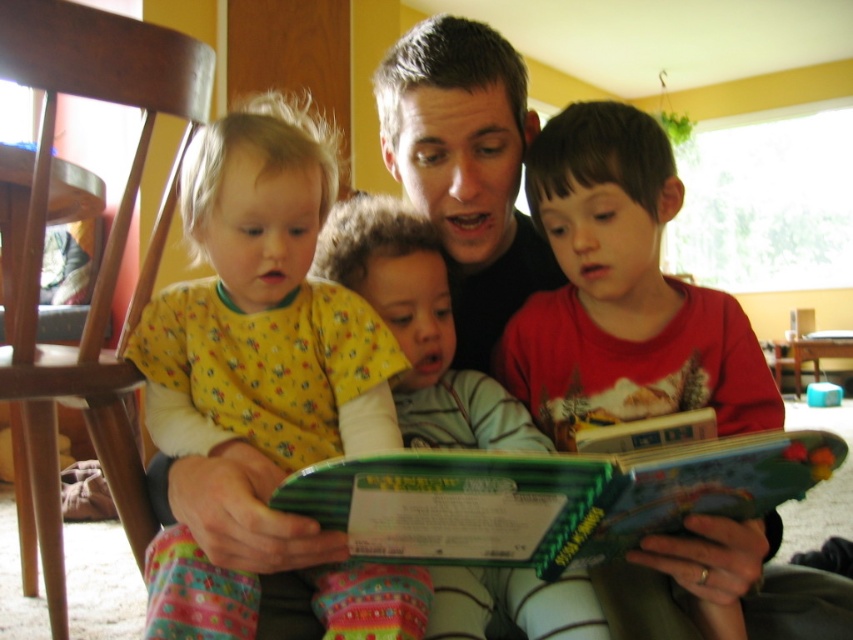
Question: Among these objects, which one is farthest from the camera?

Choices:
 (A) red cotton shirt at center
 (B) hardcover book at center
 (C) wooden chair at left
 (D) fluffy white blanket at center

Answer: (D)

Question: Which object is the closest to the floral print pajamas at left?

Choices:
 (A) hardcover book at center
 (B) wooden chair at left
 (C) red cotton shirt at center
 (D) fluffy white blanket at center

Answer: (D)

Question: Can you confirm if hardcover book at center is positioned below fluffy white blanket at center?

Choices:
 (A) no
 (B) yes

Answer: (B)

Question: Does wooden chair at left have a lesser width compared to fluffy white blanket at center?

Choices:
 (A) no
 (B) yes

Answer: (A)

Question: Considering the relative positions of floral print pajamas at left and fluffy white blanket at center in the image provided, where is floral print pajamas at left located with respect to fluffy white blanket at center?

Choices:
 (A) below
 (B) above

Answer: (B)

Question: Which object is closer to the camera taking this photo?

Choices:
 (A) wooden chair at left
 (B) red cotton shirt at center

Answer: (B)